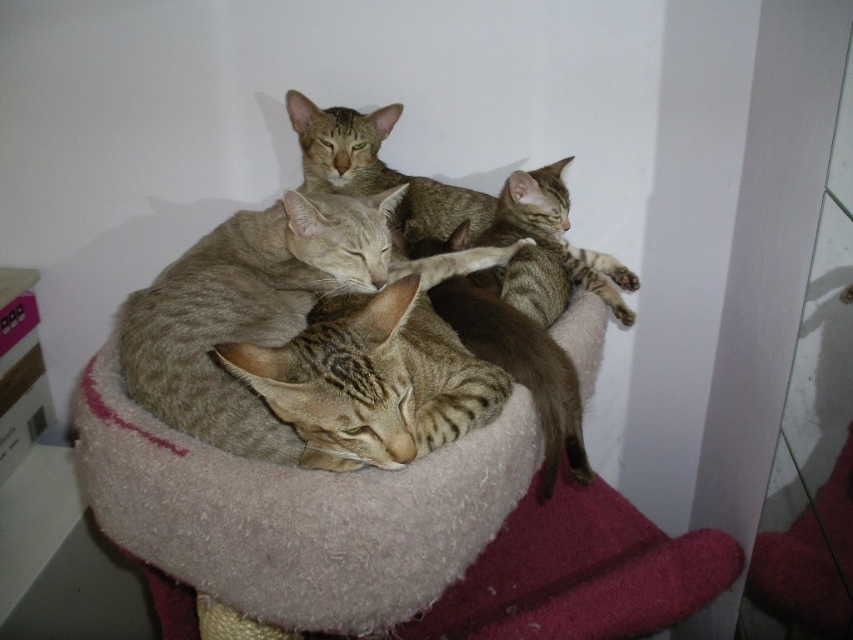
You are a cat owner who wants to ensure your cat has enough space to stretch out on the beige woolen cat bed at center. Given that the cat bed is taller than the tabby fur cat at center, can the cat comfortably stretch out on the bed?

The beige woolen cat bed at center is taller than the tabby fur cat at center, so the cat can comfortably stretch out on the bed since the bed provides enough vertical space for the cat to extend its body.

You are a cat owner who wants to place a new toy on the cat tree. The toy is small enough to fit between the beige woolen cat bed at center and the tabby fur cat at center. Based on the scene, can you determine if there is enough space between them to place the toy?

The beige woolen cat bed at center is to the left of the tabby fur cat at center, so there is space between them where the toy can be placed.

You are a cat owner who wants to ensure your cats are safe on the cat tree. Based on the image, is the tabby fur cat at center resting on top of the beige woolen cat bed at center or underneath it?

The beige woolen cat bed at center is positioned under the tabby fur cat at center, so the cat is resting on top of it.